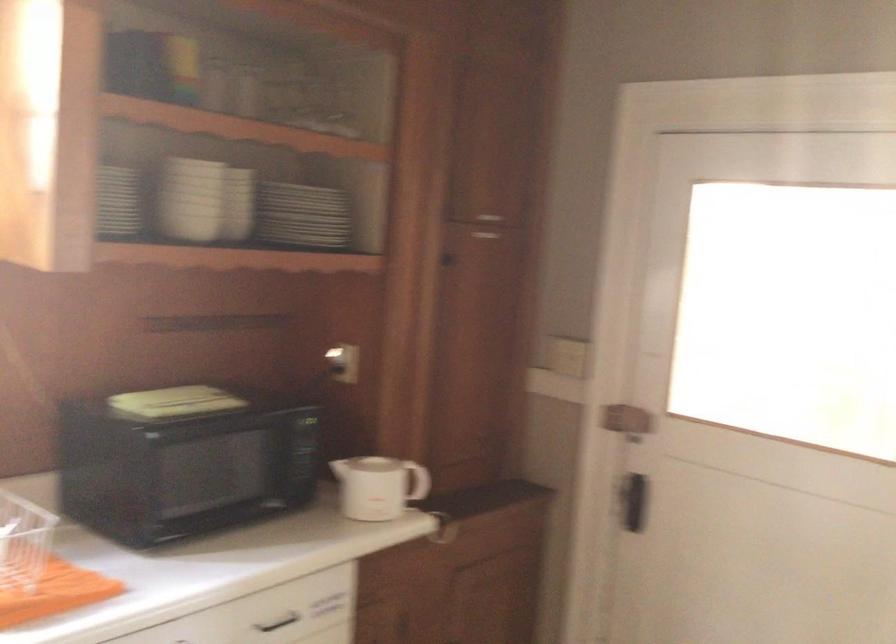
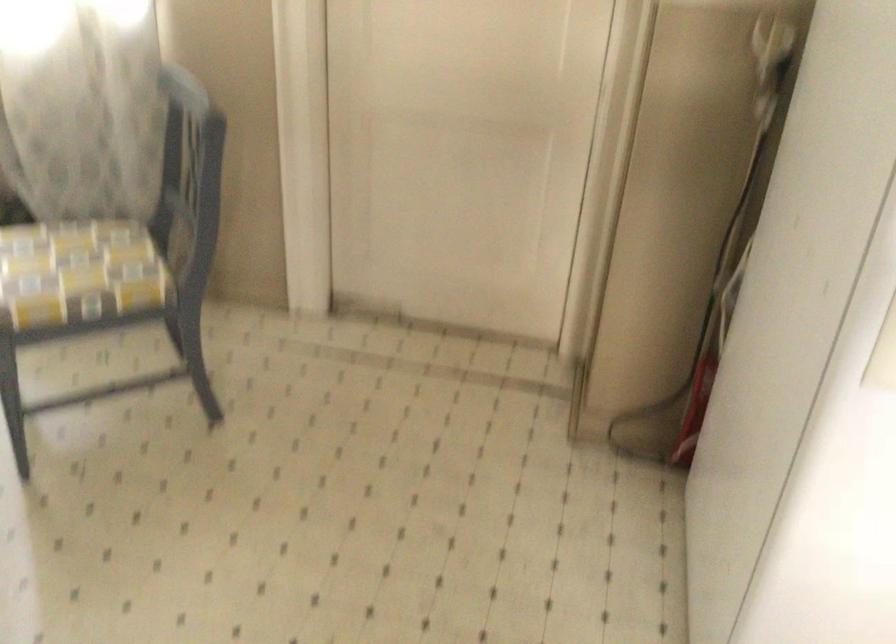
The images are taken continuously from a first-person perspective. In which direction is your viewpoint rotating?

The camera rotated toward right-down.